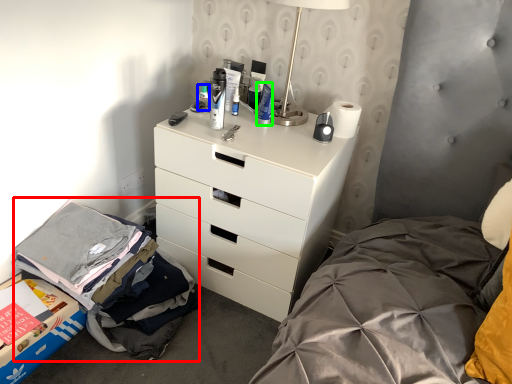
Question: Which object is the closest to the clothing (highlighted by a red box)? Choose among these: toiletry (highlighted by a blue box) or toiletry (highlighted by a green box).

Choices:
 (A) toiletry
 (B) toiletry

Answer: (A)